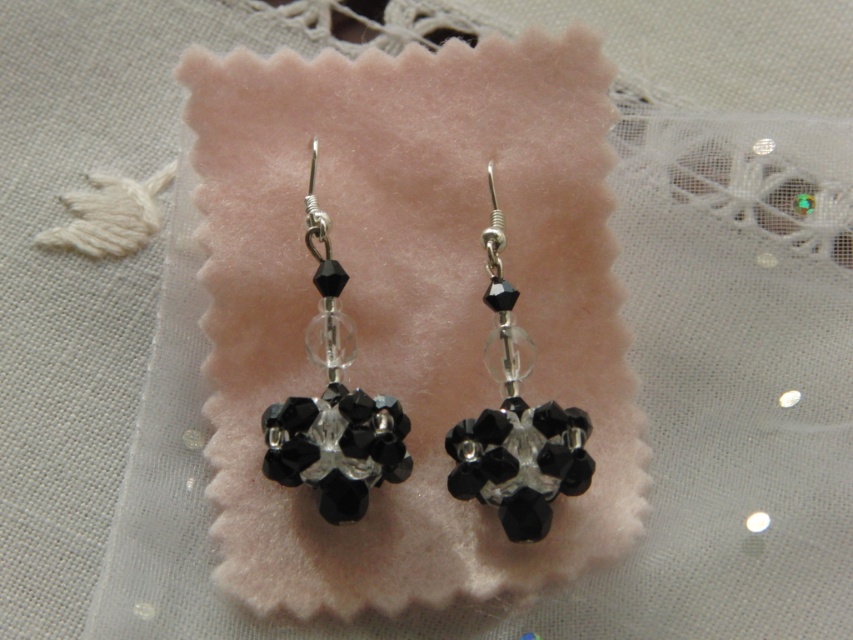
Question: Which object is closer to the camera taking this photo?

Choices:
 (A) black crystal cluster at center
 (B) black crystal earrings at center

Answer: (A)

Question: Which point is closer to the camera?

Choices:
 (A) black crystal earrings at center
 (B) black crystal cluster at center

Answer: (B)

Question: Can you confirm if black crystal earrings at center is smaller than black crystal cluster at center?

Choices:
 (A) no
 (B) yes

Answer: (B)

Question: From the image, what is the correct spatial relationship of black crystal earrings at center in relation to black crystal cluster at center?

Choices:
 (A) left
 (B) right

Answer: (A)

Question: Which object is closer to the camera taking this photo?

Choices:
 (A) black crystal earrings at center
 (B) black crystal cluster at center

Answer: (B)

Question: Observing the image, what is the correct spatial positioning of black crystal earrings at center in reference to black crystal cluster at center?

Choices:
 (A) right
 (B) left

Answer: (B)